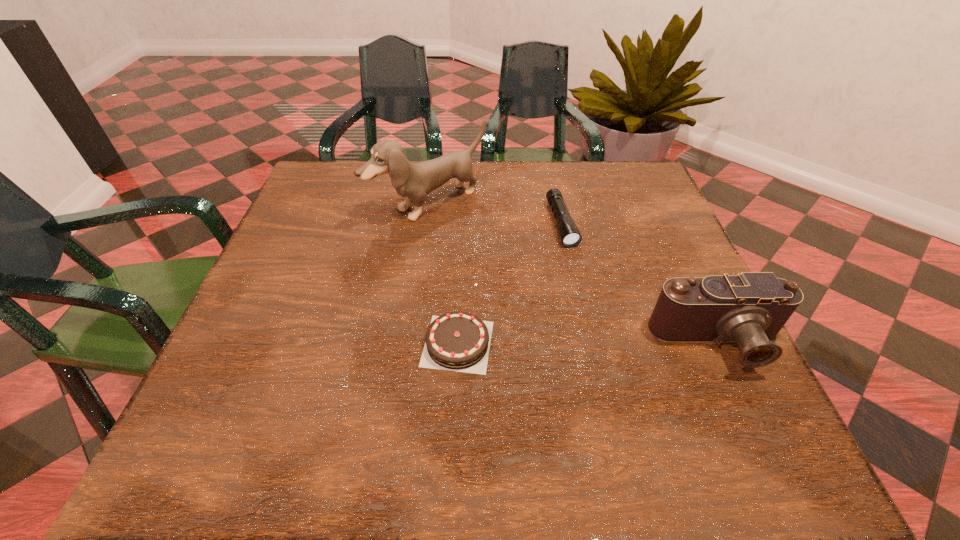
Identify the location of vacant space on the desktop that is between the chocolate cake and the camera and is positioned at the face of the tallest object. The height and width of the screenshot is (540, 960). (595, 343).

Find the location of a particular element. This screenshot has height=540, width=960. vacant spot on the desktop that is between the chocolate cake and the second tallest object and is positioned at the lens end of the flashlight is located at coordinates (610, 343).